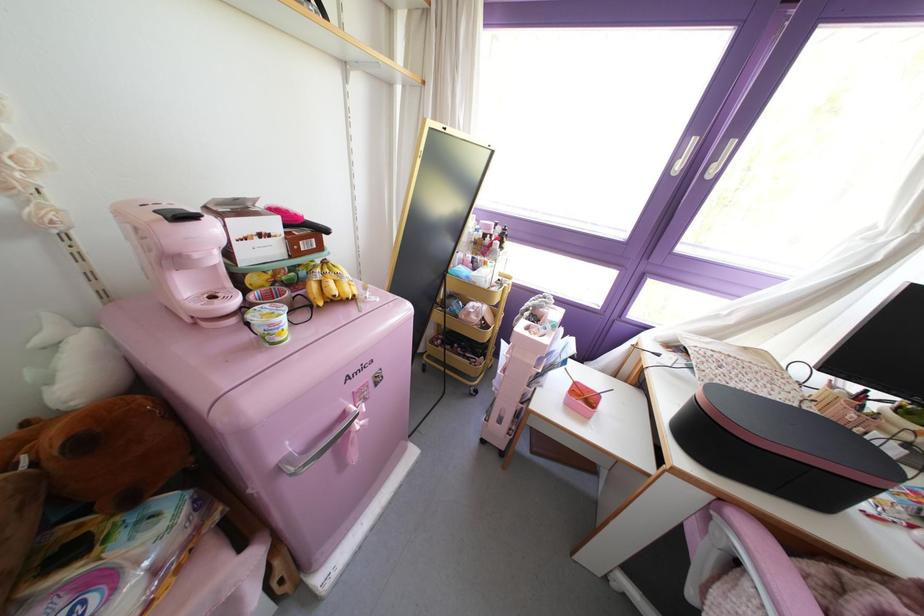
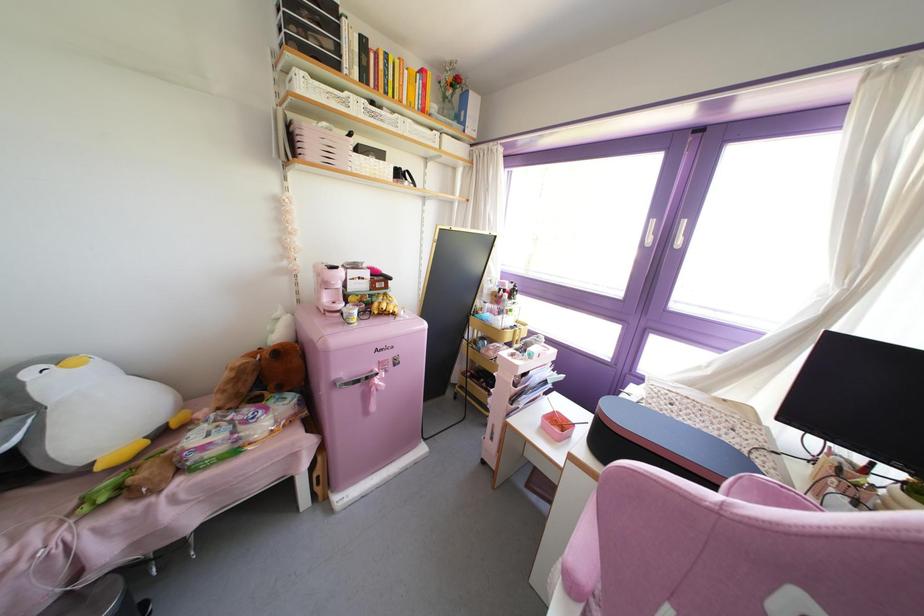
Find the pixel in the second image that matches the point at 186,289 in the first image.

(324, 297)